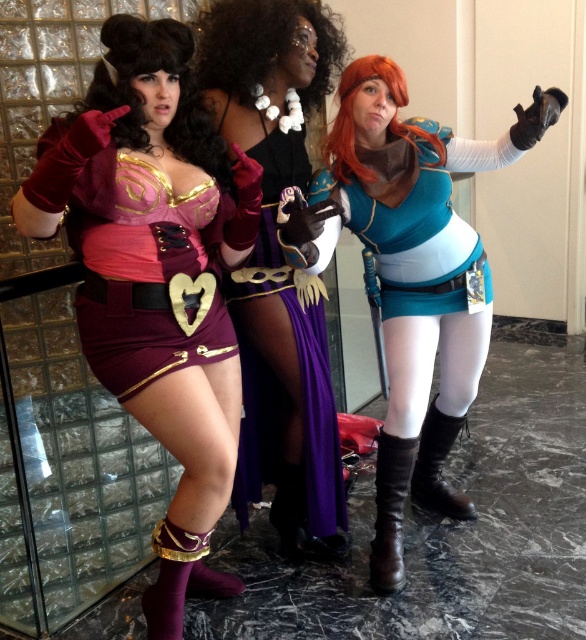
In the image, there are a shiny purple dress at center and a curly black wig at center. Which one is positioned to the right?

The shiny purple dress at center is to the right of the curly black wig at center.

You are standing at the entrance of the convention center and see the shiny purple dress at center. Can you estimate its location using coordinates?

The shiny purple dress at center is located at coordinates point (277,264).

You are a photographer setting up a shot of the teal matte armor at center and the orange synthetic wig at right. If you want to frame both objects equally in your camera, which object should you move closer to the camera and why?

The orange synthetic wig at right should be moved closer to the camera because the teal matte armor at center is wider, so bringing the smaller orange synthetic wig at right forward will balance their sizes in the frame.